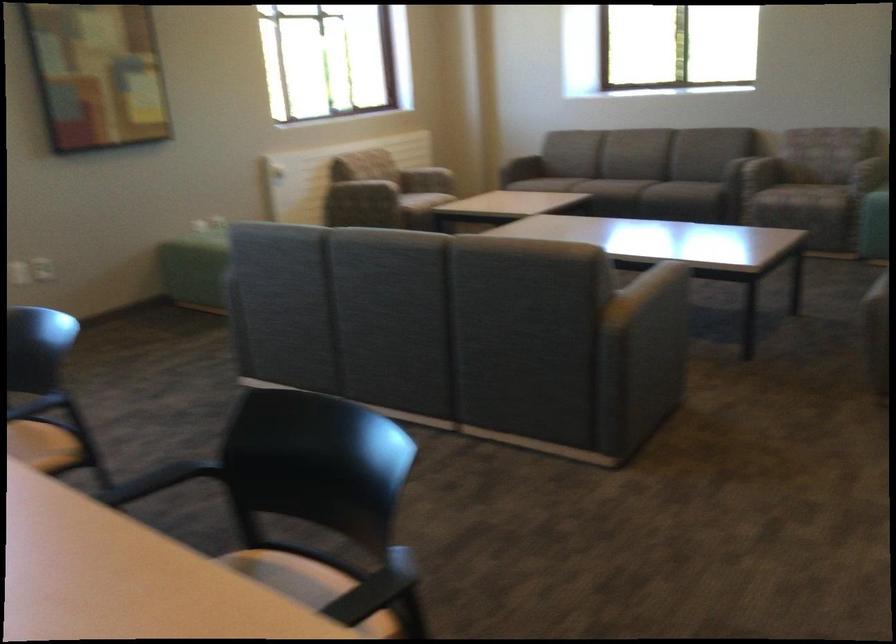
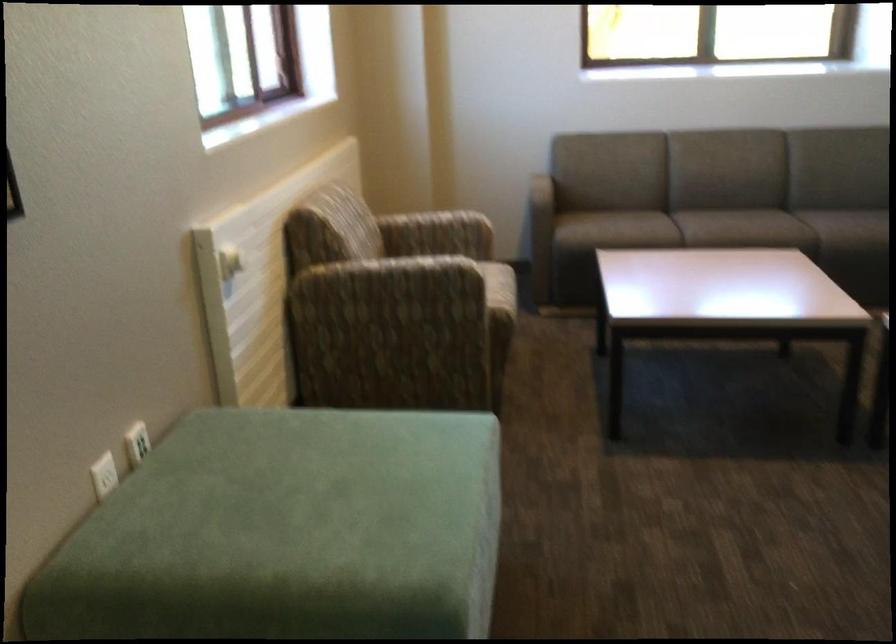
The point at (x=424, y=181) is marked in the first image. Where is the corresponding point in the second image?

(458, 254)